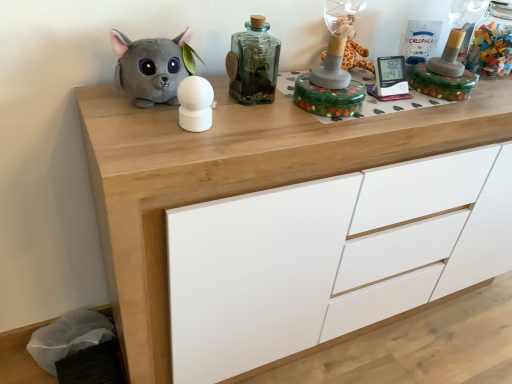
Question: From the image's perspective, relative to white matte sphere at center, the 2th toy from the left, is wooden chest of drawers at center above or below?

Choices:
 (A) below
 (B) above

Answer: (A)

Question: Is point (137, 122) closer or farther from the camera than point (195, 124)?

Choices:
 (A) farther
 (B) closer

Answer: (A)

Question: Which object is positioned closest to the translucent glass bottle at center, marked as the second bottle in a right-to-left arrangement?

Choices:
 (A) green floral box at center, acting as the 1th toy starting from the right
 (B) wooden chest of drawers at center
 (C) gray plush toy at left, which ranks as the 1th toy in left-to-right order
 (D) transparent glass jar at upper right, the 2th bottle positioned from the front
 (E) white matte sphere at center, which is the 2th toy from right to left

Answer: (A)

Question: Which object is the closest to the gray plush toy at left, which ranks as the 1th toy in left-to-right order?

Choices:
 (A) transparent glass jar at upper right, which is the second bottle from left to right
 (B) wooden chest of drawers at center
 (C) green floral box at center, the third toy positioned from the left
 (D) translucent glass bottle at center, the first bottle when ordered from left to right
 (E) white matte sphere at center, which is the 2th toy from right to left

Answer: (E)